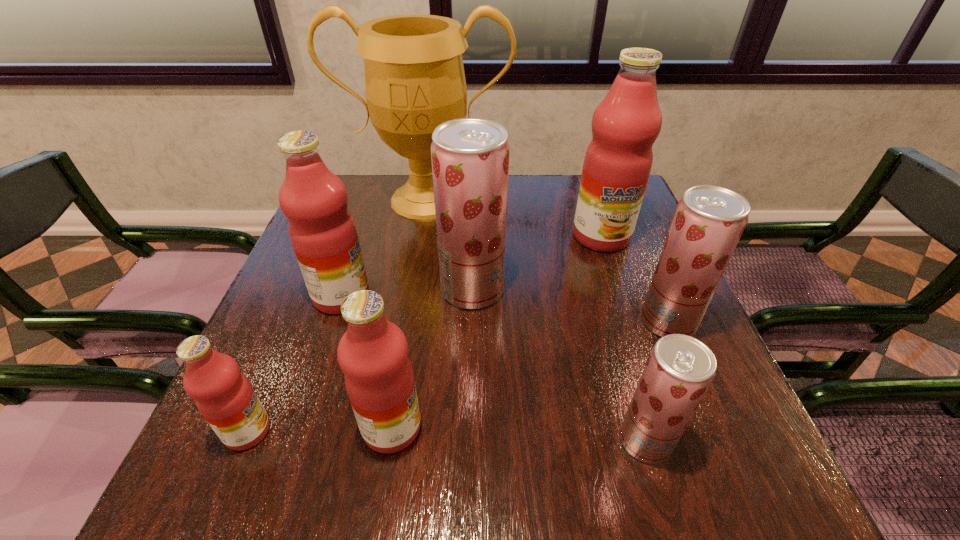
You are a GUI agent. You are given a task and a screenshot of the screen. Output one action in this format:
    pyautogui.click(x=<x>, y=<y>)
    Task: Click on the object that is positioned at the far edge
    
    Given the screenshot: What is the action you would take?
    (414, 75)

Image resolution: width=960 pixels, height=540 pixels. Identify the location of trophy that is positioned at the left edge. (414, 75).

Locate an element on the screen. The width and height of the screenshot is (960, 540). object positioned at the far left corner is located at coordinates (414, 75).

Where is `object present at the near left corner`? This screenshot has width=960, height=540. object present at the near left corner is located at coordinates (223, 395).

Identify the location of object present at the near right corner. The width and height of the screenshot is (960, 540). (679, 370).

The image size is (960, 540). I want to click on free space at the far edge of the desktop, so (539, 195).

Identify the location of vacant space at the near edge of the desktop. The width and height of the screenshot is (960, 540). (492, 497).

You are a GUI agent. You are given a task and a screenshot of the screen. Output one action in this format:
    pyautogui.click(x=<x>, y=<y>)
    Task: Click on the vacant region at the left edge of the desktop
    The width and height of the screenshot is (960, 540).
    Given the screenshot: What is the action you would take?
    pyautogui.click(x=289, y=315)

Where is `free location at the right edge`? Image resolution: width=960 pixels, height=540 pixels. free location at the right edge is located at coordinates (637, 372).

What are the coordinates of `blank space at the far left corner of the desktop` in the screenshot? It's located at (354, 210).